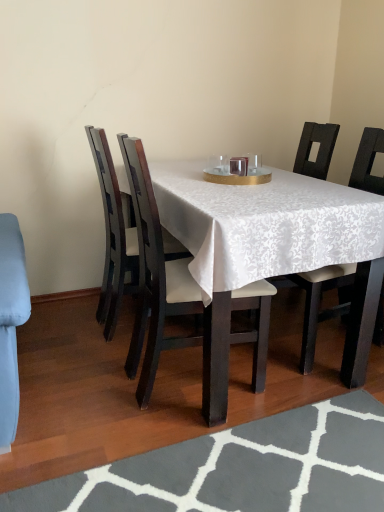
Question: Does white fabric-covered chair at center, which is counted as the second chair, starting from the left, have a greater width compared to gray textured rug at lower center?

Choices:
 (A) yes
 (B) no

Answer: (B)

Question: From a real-world perspective, is white fabric-covered chair at center, which is counted as the 3th chair, starting from the right, physically below gray textured rug at lower center?

Choices:
 (A) yes
 (B) no

Answer: (B)

Question: Is white fabric-covered chair at center, which is counted as the 3th chair, starting from the right, further to camera compared to gray textured rug at lower center?

Choices:
 (A) no
 (B) yes

Answer: (B)

Question: From the image's perspective, would you say white fabric-covered chair at center, which is counted as the 3th chair, starting from the right, is positioned over gray textured rug at lower center?

Choices:
 (A) yes
 (B) no

Answer: (A)

Question: Is white fabric-covered chair at center, which is counted as the second chair, starting from the left, shorter than gray textured rug at lower center?

Choices:
 (A) yes
 (B) no

Answer: (B)

Question: Considering the positions of white fabric-covered chair at center, which is counted as the second chair, starting from the left, and gray textured rug at lower center in the image, is white fabric-covered chair at center, which is counted as the second chair, starting from the left, bigger or smaller than gray textured rug at lower center?

Choices:
 (A) small
 (B) big

Answer: (B)

Question: Looking at their shapes, would you say white fabric-covered chair at center, which is counted as the 3th chair, starting from the right, is wider or thinner than gray textured rug at lower center?

Choices:
 (A) thin
 (B) wide

Answer: (A)

Question: Relative to gray textured rug at lower center, is white fabric-covered chair at center, which is counted as the second chair, starting from the left, in front or behind?

Choices:
 (A) behind
 (B) front

Answer: (A)

Question: Considering the positions of point (144, 317) and point (253, 467), is point (144, 317) closer or farther from the camera than point (253, 467)?

Choices:
 (A) closer
 (B) farther

Answer: (B)

Question: Is white fabric chair at center, placed as the 2th chair when sorted from right to left, wider or thinner than white fabric-covered chair at center, which is counted as the 3th chair, starting from the right?

Choices:
 (A) wide
 (B) thin

Answer: (B)

Question: Would you say white fabric chair at center, placed as the 2th chair when sorted from right to left, is inside or outside white fabric-covered chair at center, which is counted as the second chair, starting from the left?

Choices:
 (A) outside
 (B) inside

Answer: (A)

Question: From a real-world perspective, relative to white fabric-covered chair at center, which is counted as the second chair, starting from the left, is white fabric chair at center, placed as the 2th chair when sorted from right to left, vertically above or below?

Choices:
 (A) below
 (B) above

Answer: (B)

Question: Is white fabric chair at center, acting as the 3th chair starting from the left, in front of or behind white fabric-covered chair at center, which is counted as the 3th chair, starting from the right, in the image?

Choices:
 (A) behind
 (B) front

Answer: (A)

Question: From a real-world perspective, is gray textured rug at lower center above or below white fabric-covered chair at center, which is counted as the second chair, starting from the left?

Choices:
 (A) above
 (B) below

Answer: (B)

Question: Visually, is gray textured rug at lower center positioned to the left or to the right of white fabric-covered chair at center, which is counted as the second chair, starting from the left?

Choices:
 (A) left
 (B) right

Answer: (B)